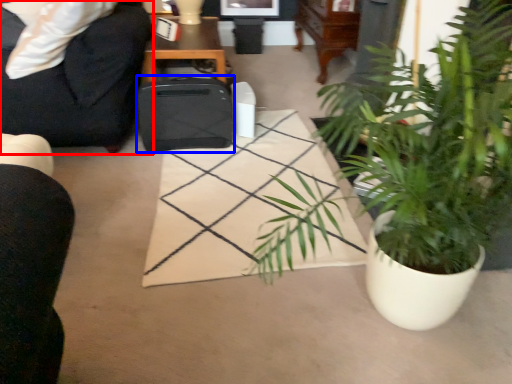
Question: Which point is further to the camera, chair (highlighted by a red box) or luggage (highlighted by a blue box)?

Choices:
 (A) chair
 (B) luggage

Answer: (B)